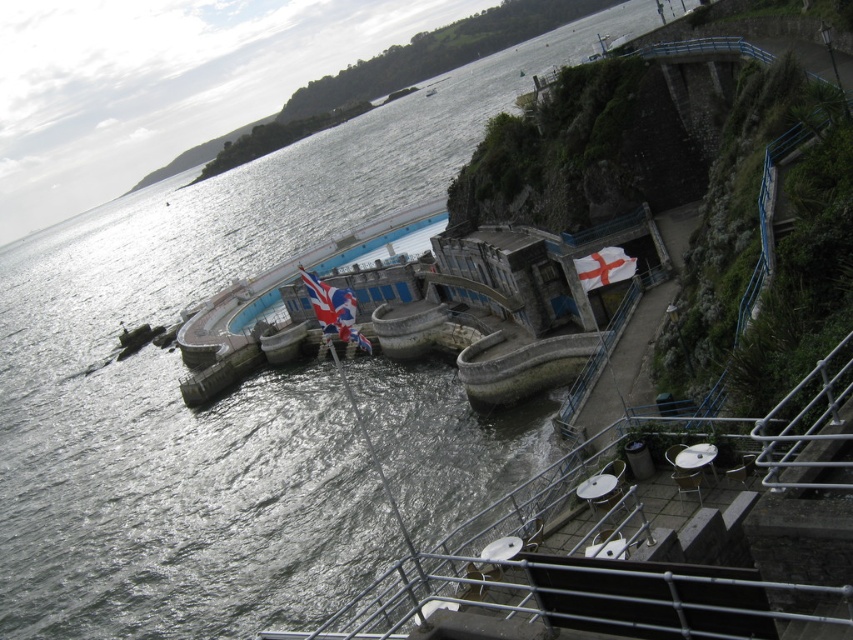
You are a tourist visiting the coastal area and want to take a photo that includes both the blue concrete pool at center and the white fabric flag at upper right. Given their sizes, which object should you focus on to ensure both are visible in the frame?

The blue concrete pool at center is larger in size than the white fabric flag at upper right, so you should focus on the blue concrete pool at center to ensure both are visible in the frame.

You are a tourist standing at the coastal historic stone structure. You see two points marked on the ground. The first point is at coordinate point (x=328, y=333) and the second point is at coordinate point (x=625, y=262). Which point is closer to you?

Point (x=328, y=333) is in front of point (x=625, y=262), so the first point is closer to you.

You are a tourist visiting this coastal area and want to take a photo of both the blue concrete pool at center and the white fabric flag at upper right. Since you want both in the same frame, which object should you position closer to the edge of your camera viewfinder to ensure both are visible?

To include both the blue concrete pool at center and the white fabric flag at upper right in the same frame, position the white fabric flag at upper right closer to the edge of the viewfinder since the blue concrete pool at center is to the left of it, allowing both to fit within the camera frame.